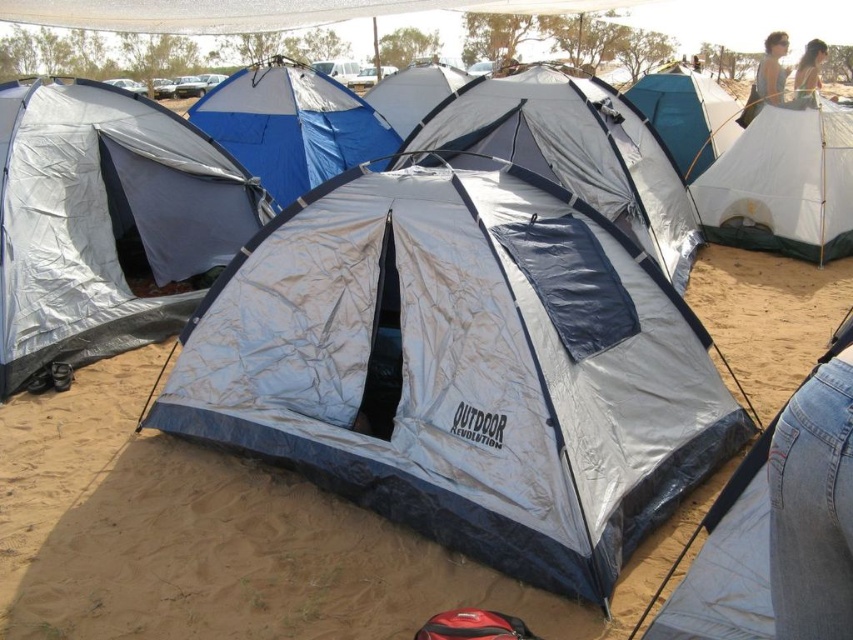
Between point (799, 118) and point (817, 81), which one is positioned in front?

Point (799, 118) is in front.

Between white canvas tent at upper right and beige fabric dress at upper right, which one has more height?

With more height is white canvas tent at upper right.

Where is `white canvas tent at upper right`? This screenshot has width=853, height=640. white canvas tent at upper right is located at coordinates (782, 184).

Is white canvas tent at upper right bigger than silver/reflective tent at center?

Yes.

Does white canvas tent at upper right have a smaller size compared to silver/reflective tent at center?

No.

Locate an element on the screen. white canvas tent at upper right is located at coordinates (782, 184).

Who is positioned more to the right, silver tarpaulin tent at center or silver/textured fabric tent at lower right?

silver/textured fabric tent at lower right is more to the right.

Describe the element at coordinates (106, 221) in the screenshot. This screenshot has height=640, width=853. I see `silver tarpaulin tent at center` at that location.

Where is `silver tarpaulin tent at center`? silver tarpaulin tent at center is located at coordinates (106, 221).